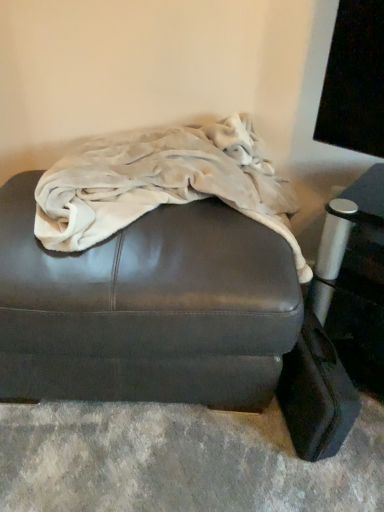
Question: Does beige fleece blanket at center turn towards black leather suitcase at lower right?

Choices:
 (A) yes
 (B) no

Answer: (B)

Question: Considering the relative positions of beige fleece blanket at center and black leather suitcase at lower right in the image provided, is beige fleece blanket at center behind black leather suitcase at lower right?

Choices:
 (A) no
 (B) yes

Answer: (A)

Question: Is beige fleece blanket at center wider than black leather suitcase at lower right?

Choices:
 (A) no
 (B) yes

Answer: (B)

Question: From the image's perspective, does beige fleece blanket at center appear lower than black leather suitcase at lower right?

Choices:
 (A) no
 (B) yes

Answer: (A)

Question: Considering the relative sizes of beige fleece blanket at center and black leather suitcase at lower right in the image provided, is beige fleece blanket at center smaller than black leather suitcase at lower right?

Choices:
 (A) no
 (B) yes

Answer: (A)

Question: Is black leather suitcase at lower right taller or shorter than matte brown leather ottoman at center?

Choices:
 (A) short
 (B) tall

Answer: (A)

Question: From a real-world perspective, is black leather suitcase at lower right physically located above or below matte brown leather ottoman at center?

Choices:
 (A) below
 (B) above

Answer: (A)

Question: In the image, is black leather suitcase at lower right positioned in front of or behind matte brown leather ottoman at center?

Choices:
 (A) behind
 (B) front

Answer: (A)

Question: Is black leather suitcase at lower right bigger or smaller than matte brown leather ottoman at center?

Choices:
 (A) big
 (B) small

Answer: (B)

Question: From the image's perspective, is beige fleece blanket at center located above or below black leather suitcase at lower right?

Choices:
 (A) below
 (B) above

Answer: (B)

Question: Does point (183, 162) appear closer or farther from the camera than point (347, 424)?

Choices:
 (A) farther
 (B) closer

Answer: (A)

Question: Based on their positions, is beige fleece blanket at center located to the left or right of black leather suitcase at lower right?

Choices:
 (A) left
 (B) right

Answer: (A)

Question: From a real-world perspective, is beige fleece blanket at center physically located above or below black leather suitcase at lower right?

Choices:
 (A) above
 (B) below

Answer: (A)

Question: In the image, is matte brown leather ottoman at center positioned in front of or behind beige fleece blanket at center?

Choices:
 (A) front
 (B) behind

Answer: (B)

Question: Does point (170, 216) appear closer or farther from the camera than point (79, 236)?

Choices:
 (A) closer
 (B) farther

Answer: (B)